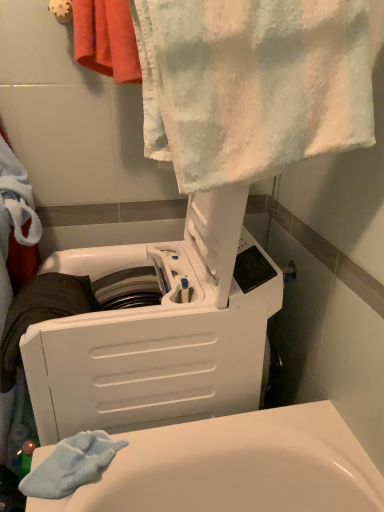
Question: Do you think red cotton towel at upper left, which is the 2th towel from front to back, is within white textured towel at upper center, which is the second towel from back to front, or outside of it?

Choices:
 (A) outside
 (B) inside

Answer: (A)

Question: Is red cotton towel at upper left, which is the 2th towel from front to back, bigger or smaller than white textured towel at upper center, which is the second towel from back to front?

Choices:
 (A) big
 (B) small

Answer: (B)

Question: Estimate the real-world distances between objects in this image. Which object is closer to the white textured towel at upper center, which ranks as the 1th towel in front-to-back order?

Choices:
 (A) white plastic washing machine at upper center
 (B) red cotton towel at upper left, marked as the 1th towel in a back-to-front arrangement

Answer: (A)

Question: Which object is the farthest from the white plastic washing machine at upper center?

Choices:
 (A) white textured towel at upper center, which ranks as the 1th towel in front-to-back order
 (B) red cotton towel at upper left, which is the 2th towel from front to back

Answer: (B)